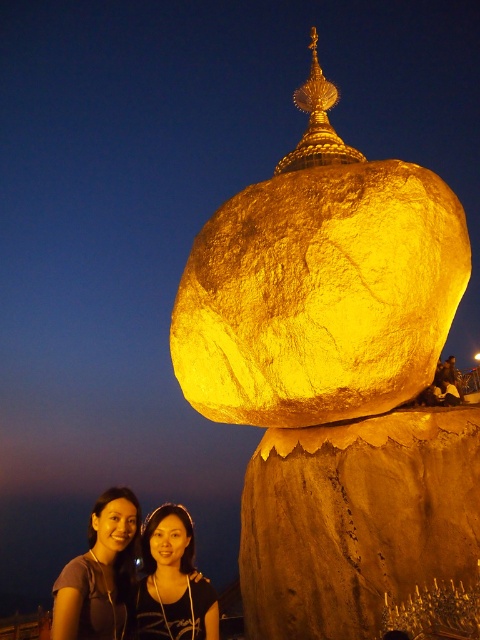
Question: Which object appears farthest from the camera in this image?

Choices:
 (A) matte black hair at lower left
 (B) matte black hair at lower center

Answer: (B)

Question: Does matte black hair at lower left appear over matte black hair at lower center?

Choices:
 (A) yes
 (B) no

Answer: (B)

Question: Which of the following is the closest to the observer?

Choices:
 (A) (80, 556)
 (B) (204, 596)

Answer: (B)

Question: Is matte black hair at lower left behind matte black hair at lower center?

Choices:
 (A) no
 (B) yes

Answer: (A)

Question: Does matte black hair at lower left come behind matte black hair at lower center?

Choices:
 (A) yes
 (B) no

Answer: (B)